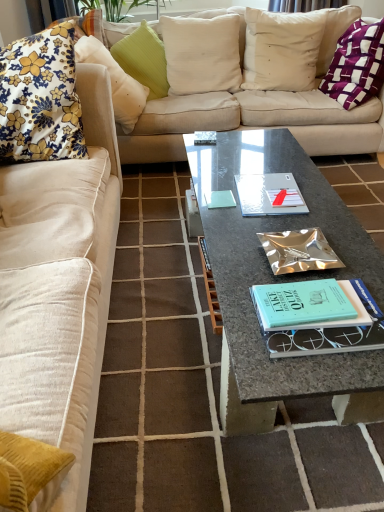
Locate an element on the screen. This screenshot has height=512, width=384. free point in front of silver metallic notebook at center is located at coordinates (269, 229).